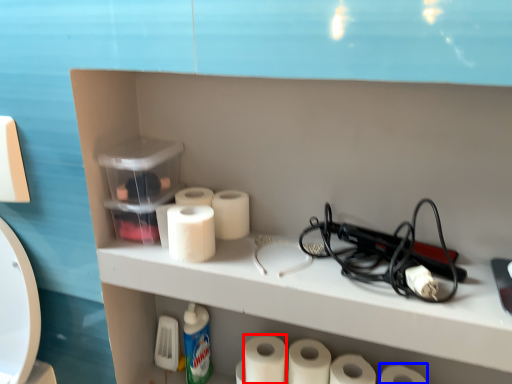
Question: Which of the following is the closest to the observer, toilet paper (highlighted by a red box) or toilet paper (highlighted by a blue box)?

Choices:
 (A) toilet paper
 (B) toilet paper

Answer: (B)